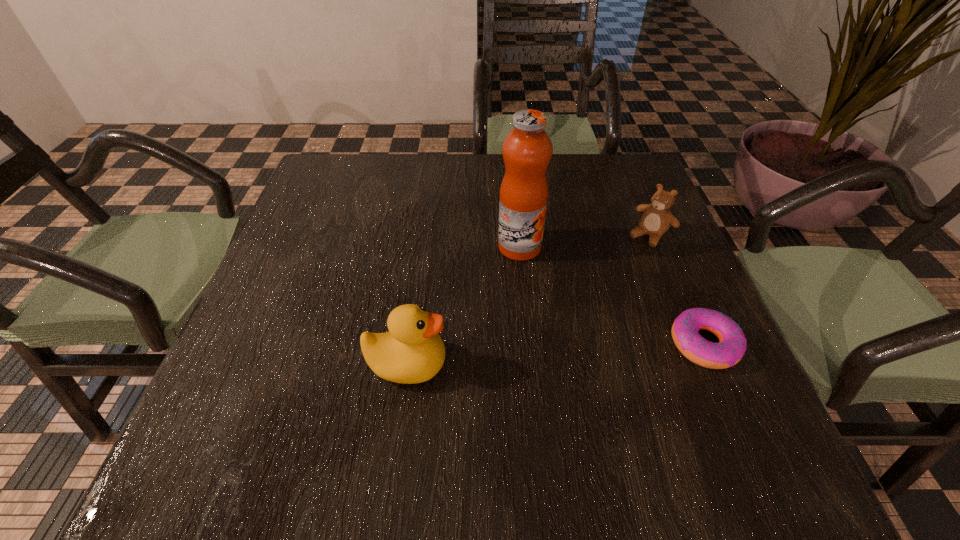
Where is `vacant space located on the front label of the second object from left to right`? vacant space located on the front label of the second object from left to right is located at coordinates (571, 328).

Identify the location of free space located on the front-facing side of the third tallest object. (555, 335).

The image size is (960, 540). Identify the location of vacant space situated on the front-facing side of the third tallest object. (612, 274).

Locate an element on the screen. Image resolution: width=960 pixels, height=540 pixels. blank space located on the front-facing side of the third tallest object is located at coordinates (617, 269).

Identify the location of duck at the near edge. The image size is (960, 540). (412, 351).

Where is `doughnut at the near edge`? The width and height of the screenshot is (960, 540). doughnut at the near edge is located at coordinates (732, 343).

Find the location of `doughnut that is positioned at the right edge`. doughnut that is positioned at the right edge is located at coordinates (732, 343).

This screenshot has height=540, width=960. What are the coordinates of `teddy bear that is at the right edge` in the screenshot? It's located at (656, 219).

Image resolution: width=960 pixels, height=540 pixels. Identify the location of object that is at the near right corner. [732, 343].

Where is `free space at the far edge of the desktop`? This screenshot has width=960, height=540. free space at the far edge of the desktop is located at coordinates (458, 153).